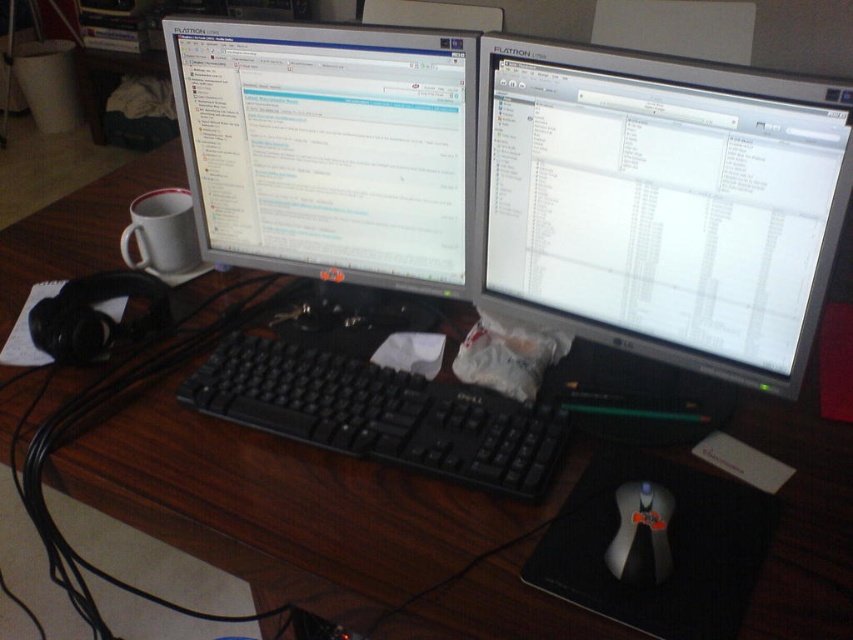
Can you confirm if silver metallic monitor at center is smaller than matte black monitor at center?

Incorrect, silver metallic monitor at center is not smaller in size than matte black monitor at center.

This screenshot has width=853, height=640. What do you see at coordinates (660, 204) in the screenshot?
I see `silver metallic monitor at center` at bounding box center [660, 204].

Identify the location of silver metallic monitor at center. (660, 204).

Which is more to the left, silver metallic monitor at center or black plastic keyboard at center?

black plastic keyboard at center is more to the left.

Who is more forward, (752, 212) or (317, 410)?

Point (752, 212)

The width and height of the screenshot is (853, 640). Identify the location of silver metallic monitor at center. (660, 204).

Who is lower down, matte black monitor at center or black plastic mouse at center?

black plastic mouse at center

Does matte black monitor at center appear over black plastic mouse at center?

Yes.

Is point (201, 99) in front of point (624, 509)?

No, it is behind (624, 509).

The width and height of the screenshot is (853, 640). In order to click on matte black monitor at center in this screenshot , I will do `click(329, 148)`.